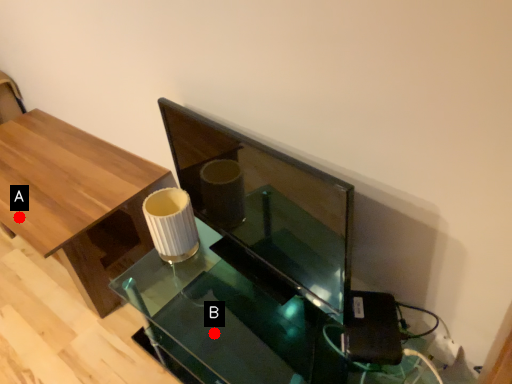
Question: Two points are circled on the image, labeled by A and B beside each circle. Which point is closer to the camera taking this photo?

Choices:
 (A) A is closer
 (B) B is closer

Answer: (A)